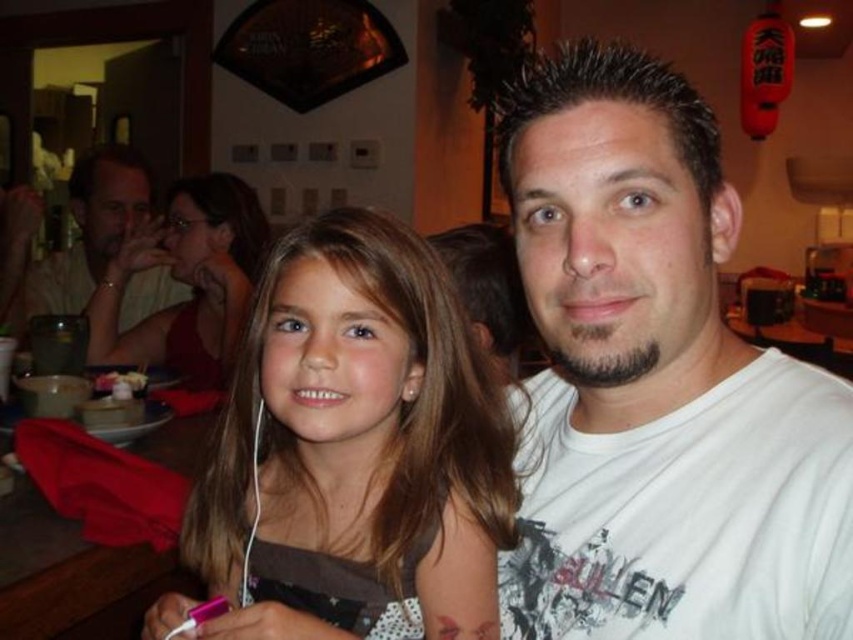
You are a customer in a restaurant and want to locate the matte red dress at upper left. Where exactly should you look?

The matte red dress at upper left is located at point (186, 282).

You are a photographer trying to capture a clear shot of both the matte red dress at upper left and the matte white shirt at upper left. Since you want to focus on the dress first, which one should you adjust your camera focus for first?

The matte red dress at upper left is closer to the viewer than the matte white shirt at upper left, so you should adjust your camera focus for the matte red dress at upper left first.

You are a photographer setting up for a group photo. You have two subjects wearing the matte red dress at upper left and the matte white shirt at upper left. You want to arrange them side by side in a way that their clothing widths don not clash. Which clothing item should be placed on the left to maintain visual balance?

The matte red dress at upper left should be placed on the left because it is thinner than the matte white shirt at upper left, creating a balanced arrangement where the narrower garment is positioned first.